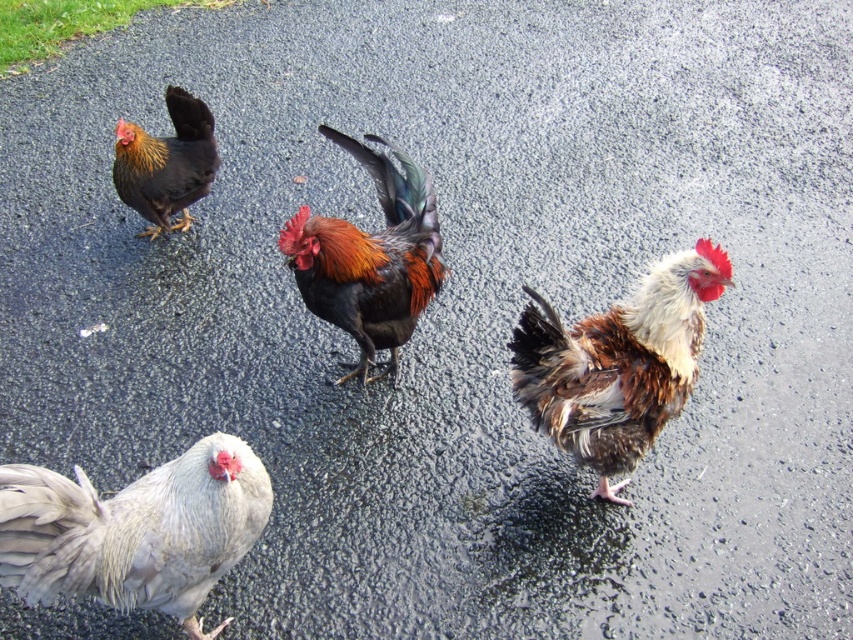
You are a photographer trying to capture the shiny multicolored rooster at center. You notice a puddle at point (370, 259). Will the puddle interfere with your shot of the shiny multicolored rooster at center?

The puddle at point (370, 259) is exactly where the shiny multicolored rooster at center is located, so the puddle will interfere with the shot.

You are standing at the center of the image and want to walk towards the point labeled as point (376,152). Will you pass by the point labeled as point (186,177) before reaching your destination?

Yes, you will pass by point (186,177) before reaching point (376,152) because point (376,152) is in front of point (186,177).

You are a farmer checking on your chickens in the rain. You see the brown speckled feathers at center and the black glossy rooster at upper left. Which chicken is positioned to the right of the other?

The brown speckled feathers at center is to the right of the black glossy rooster at upper left.